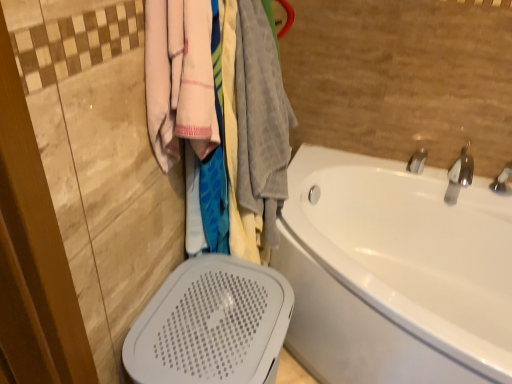
Question: Would you say silver metallic faucet at upper right, which ranks as the 1th tap in right-to-left order, is outside silver metallic tap at upper right, which is counted as the 1th tap, starting from the left?

Choices:
 (A) yes
 (B) no

Answer: (A)

Question: Is silver metallic faucet at upper right, acting as the second tap starting from the left, positioned before silver metallic tap at upper right, which is counted as the 1th tap, starting from the left?

Choices:
 (A) yes
 (B) no

Answer: (A)

Question: Considering the relative sizes of silver metallic faucet at upper right, acting as the second tap starting from the left, and silver metallic tap at upper right, which is the 2th tap from right to left, in the image provided, is silver metallic faucet at upper right, acting as the second tap starting from the left, taller than silver metallic tap at upper right, which is the 2th tap from right to left,?

Choices:
 (A) yes
 (B) no

Answer: (A)

Question: From the image's perspective, does silver metallic faucet at upper right, acting as the second tap starting from the left, appear lower than silver metallic tap at upper right, which is counted as the 1th tap, starting from the left?

Choices:
 (A) no
 (B) yes

Answer: (B)

Question: Does silver metallic faucet at upper right, which ranks as the 1th tap in right-to-left order, have a larger size compared to silver metallic tap at upper right, which is counted as the 1th tap, starting from the left?

Choices:
 (A) yes
 (B) no

Answer: (A)

Question: From the image's perspective, is silver metallic faucet at upper right, which ranks as the 1th tap in right-to-left order, over silver metallic tap at upper right, which is counted as the 1th tap, starting from the left?

Choices:
 (A) yes
 (B) no

Answer: (B)

Question: From a real-world perspective, is white glossy bathtub at right positioned under silver metallic faucet at upper right, which ranks as the 1th tap in right-to-left order, based on gravity?

Choices:
 (A) yes
 (B) no

Answer: (A)

Question: Is white glossy bathtub at right in contact with silver metallic faucet at upper right, which ranks as the 1th tap in right-to-left order?

Choices:
 (A) no
 (B) yes

Answer: (A)

Question: Would you say silver metallic faucet at upper right, which ranks as the 1th tap in right-to-left order, is part of white glossy bathtub at right's contents?

Choices:
 (A) yes
 (B) no

Answer: (B)

Question: Is white glossy bathtub at right at the left side of silver metallic faucet at upper right, acting as the second tap starting from the left?

Choices:
 (A) yes
 (B) no

Answer: (A)

Question: From a real-world perspective, is white glossy bathtub at right physically above silver metallic faucet at upper right, which ranks as the 1th tap in right-to-left order?

Choices:
 (A) yes
 (B) no

Answer: (B)

Question: From the image's perspective, is white glossy bathtub at right below silver metallic faucet at upper right, acting as the second tap starting from the left?

Choices:
 (A) yes
 (B) no

Answer: (A)

Question: Considering the relative sizes of white glossy bathtub at right and soft cotton towels at upper left in the image provided, is white glossy bathtub at right bigger than soft cotton towels at upper left?

Choices:
 (A) no
 (B) yes

Answer: (B)